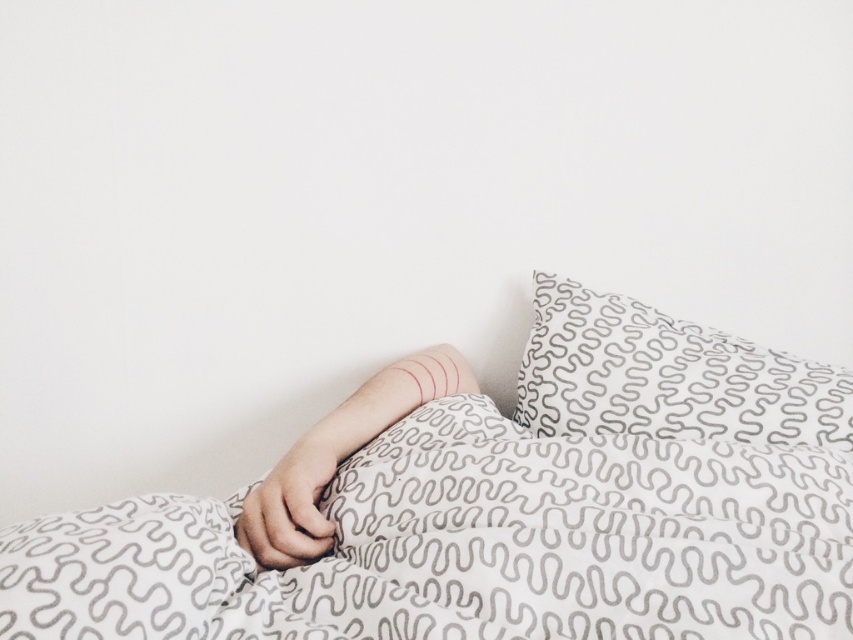
You have a small decorative item that needs to be placed on either the white textured fabric at center or the white textured pillow at upper right. Based on their sizes, which surface can accommodate the item more comfortably?

The white textured fabric at center has a larger width than the white textured pillow at upper right, so it can accommodate the item more comfortably.

What is the location of the white textured fabric at center in the image?

The white textured fabric at center is located at point (496, 506).